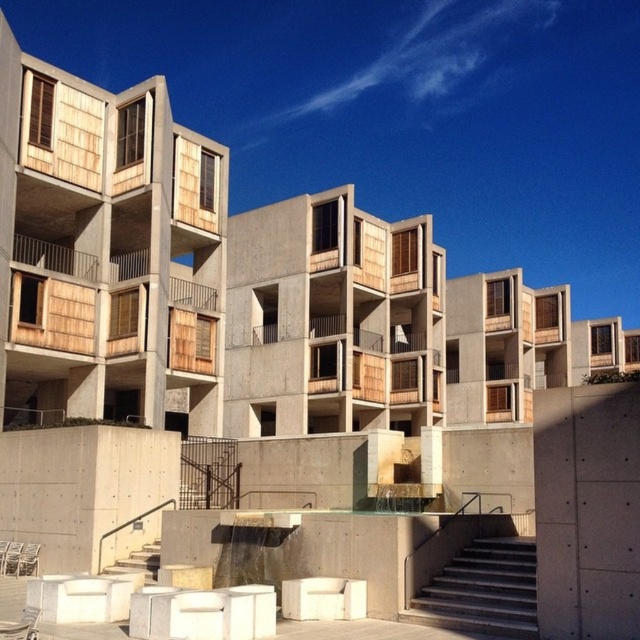
Question: Which of the following is the closest to the observer?

Choices:
 (A) concrete stairs at lower center
 (B) white concrete stairs at lower left

Answer: (A)

Question: Which of the following is the farthest from the observer?

Choices:
 (A) click(x=433, y=625)
 (B) click(x=145, y=566)

Answer: (B)

Question: Is concrete stairs at lower center thinner than white concrete stairs at lower left?

Choices:
 (A) yes
 (B) no

Answer: (A)

Question: Is the position of concrete stairs at lower center more distant than that of white concrete stairs at lower left?

Choices:
 (A) yes
 (B) no

Answer: (B)

Question: Does concrete stairs at lower center have a greater width compared to white concrete stairs at lower left?

Choices:
 (A) yes
 (B) no

Answer: (B)

Question: Which point is closer to the camera?

Choices:
 (A) (160, 548)
 (B) (448, 580)

Answer: (B)